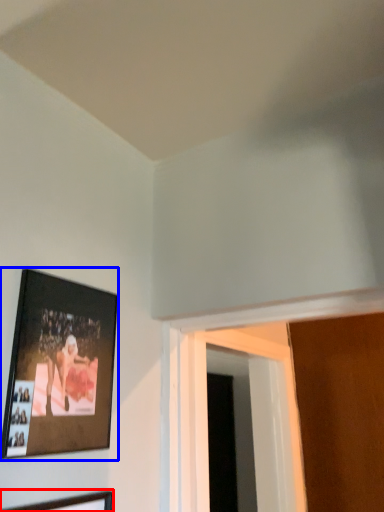
Question: Which of the following is the closest to the observer, picture frame (highlighted by a red box) or picture frame (highlighted by a blue box)?

Choices:
 (A) picture frame
 (B) picture frame

Answer: (A)